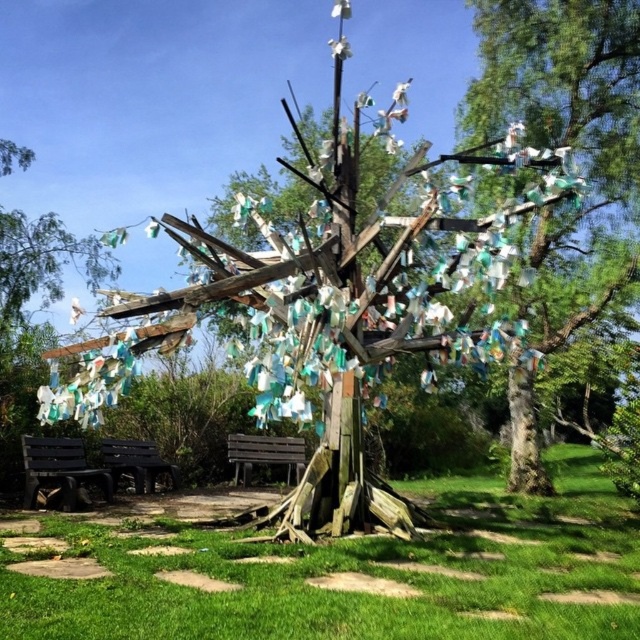
Can you confirm if black wooden bench at lower left is wider than dark brown wooden bench at lower left?

No, black wooden bench at lower left is not wider than dark brown wooden bench at lower left.

How distant is black wooden bench at lower left from dark brown wooden bench at lower left?

They are 3.71 feet apart.

Which is behind, point (74, 458) or point (124, 472)?

Positioned behind is point (124, 472).

Where is `black wooden bench at lower left`? This screenshot has width=640, height=640. black wooden bench at lower left is located at coordinates (60, 468).

Is point (72, 458) behind point (280, 460)?

That is False.

Is point (26, 454) farther from viewer compared to point (237, 452)?

That is False.

Identify the location of black wooden bench at lower left. (60, 468).

Consider the image. Between brown wooden bench at center and dark brown wooden bench at lower left, which one is positioned higher?

Positioned higher is dark brown wooden bench at lower left.

Can you confirm if brown wooden bench at center is bigger than dark brown wooden bench at lower left?

Incorrect, brown wooden bench at center is not larger than dark brown wooden bench at lower left.

The image size is (640, 640). What do you see at coordinates (264, 454) in the screenshot?
I see `brown wooden bench at center` at bounding box center [264, 454].

Locate an element on the screen. This screenshot has height=640, width=640. brown wooden bench at center is located at coordinates (264, 454).